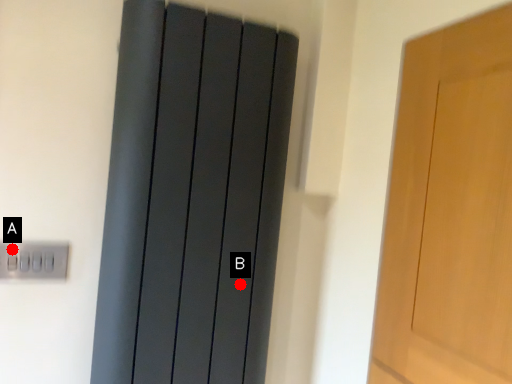
Question: Two points are circled on the image, labeled by A and B beside each circle. Which point is closer to the camera?

Choices:
 (A) A is closer
 (B) B is closer

Answer: (A)